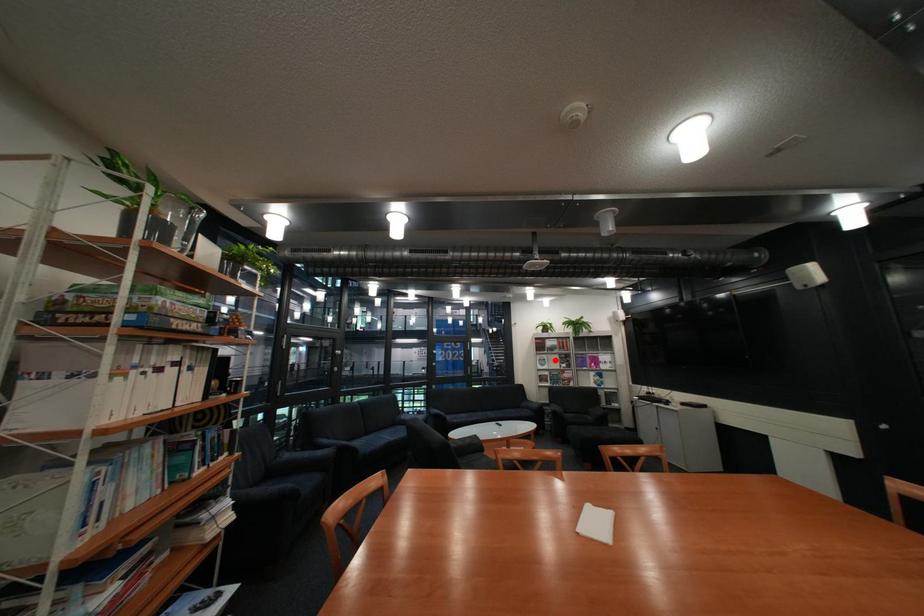
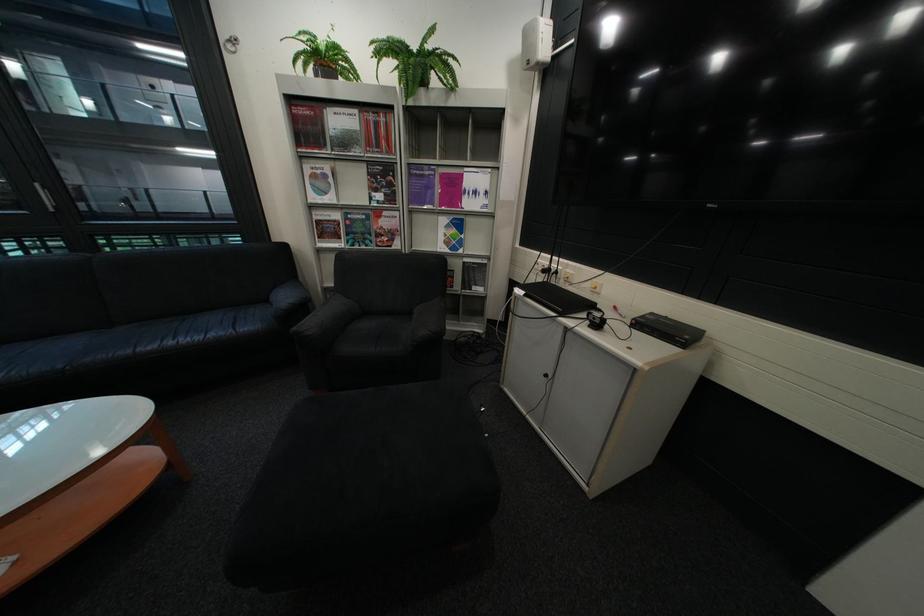
Where in the second image is the point corresponding to the highlighted location from the first image?

(329, 177)